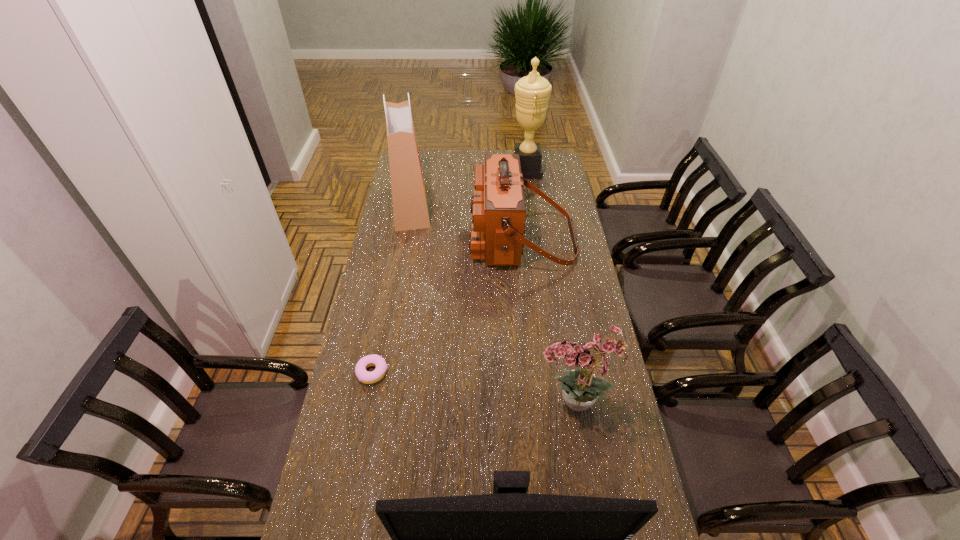
Find the location of a particular element. The image size is (960, 540). trophy cup is located at coordinates (532, 92).

Where is `shopping bag`? shopping bag is located at coordinates (410, 209).

You are a GUI agent. You are given a task and a screenshot of the screen. Output one action in this format:
    pyautogui.click(x=<x>, y=<y>)
    Task: Click on the flower arrangement
    This screenshot has width=960, height=540.
    Given the screenshot: What is the action you would take?
    pyautogui.click(x=581, y=387)

I want to click on satchel, so click(x=498, y=209).

Image resolution: width=960 pixels, height=540 pixels. In order to click on the shortest object in this screenshot , I will do `click(362, 374)`.

You are a GUI agent. You are given a task and a screenshot of the screen. Output one action in this format:
    pyautogui.click(x=<x>, y=<y>)
    Task: Click on the free space located at the front of the trophy cup with handles
    
    Given the screenshot: What is the action you would take?
    pyautogui.click(x=453, y=170)

Identify the location of vacant region located at the front of the trophy cup with handles. (457, 170).

Locate an element on the screen. The height and width of the screenshot is (540, 960). free space located at the front of the trophy cup with handles is located at coordinates [x=437, y=170].

This screenshot has width=960, height=540. I want to click on vacant space located on the front of the shopping bag, so tap(402, 249).

Where is `blank space located 0.230m on the front-facing side of the flower arrangement`? blank space located 0.230m on the front-facing side of the flower arrangement is located at coordinates pos(459,405).